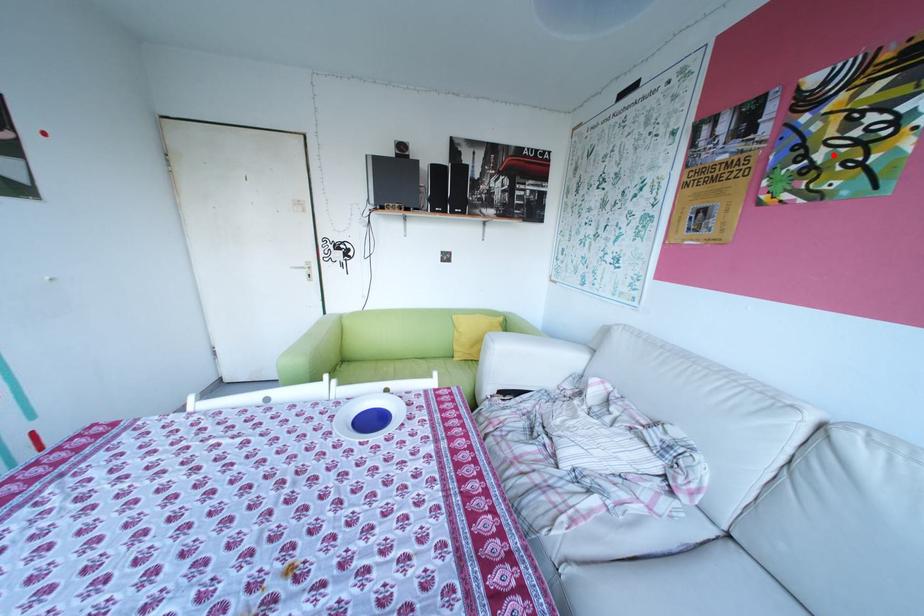
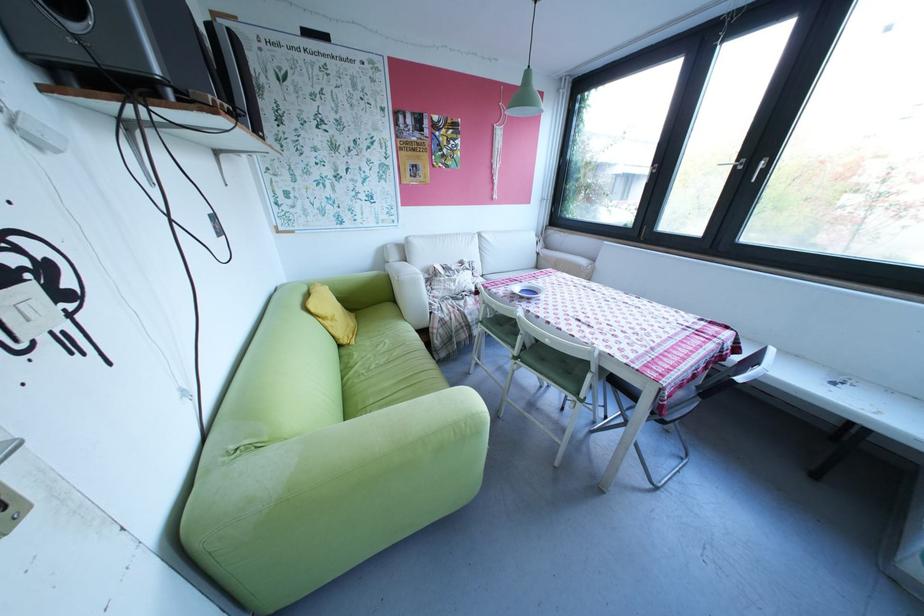
Where in the second image is the point corresponding to the highlighted location from the first image?

(457, 151)